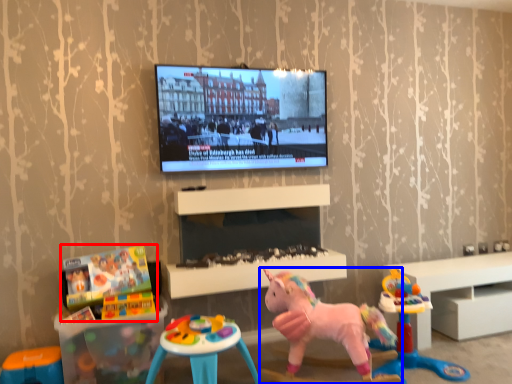
Question: Which object is closer to the camera taking this photo, toy (highlighted by a red box) or toy (highlighted by a blue box)?

Choices:
 (A) toy
 (B) toy

Answer: (B)